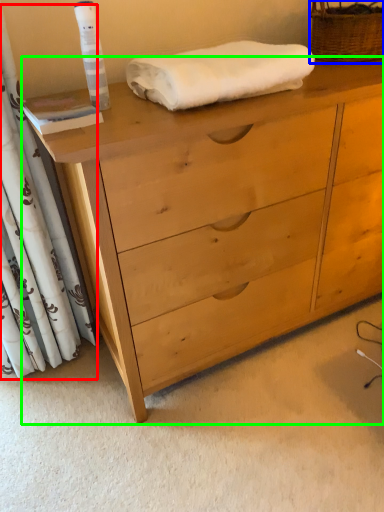
Question: Estimate the real-world distances between objects in this image. Which object is closer to curtain (highlighted by a red box), basket (highlighted by a blue box) or chest of drawers (highlighted by a green box)?

Choices:
 (A) basket
 (B) chest of drawers

Answer: (B)